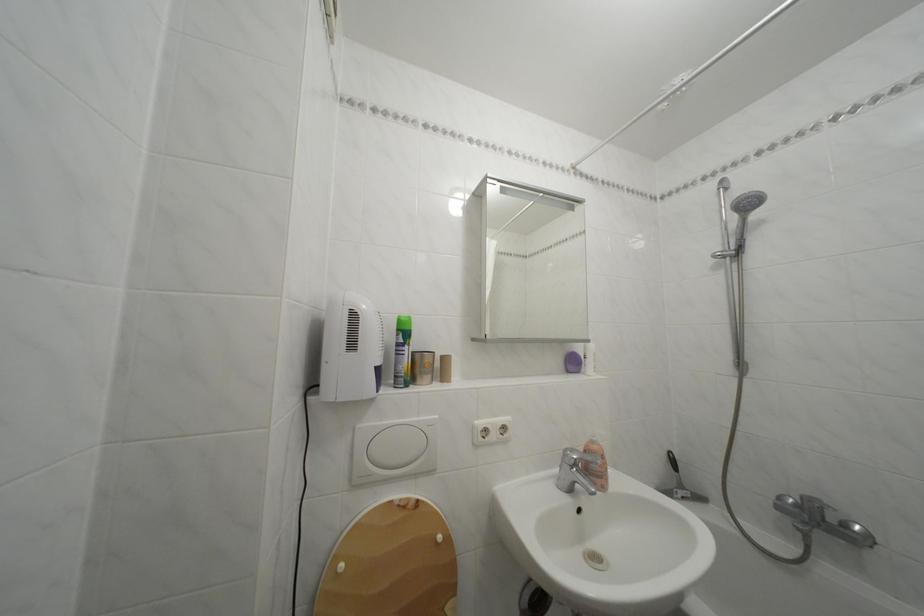
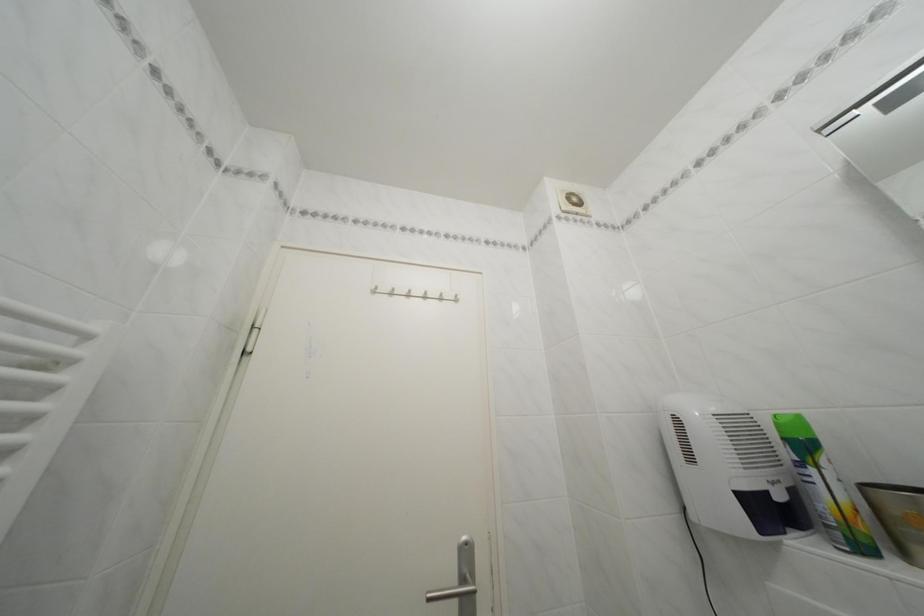
How did the camera likely rotate?

The camera's rotation is toward left-up.